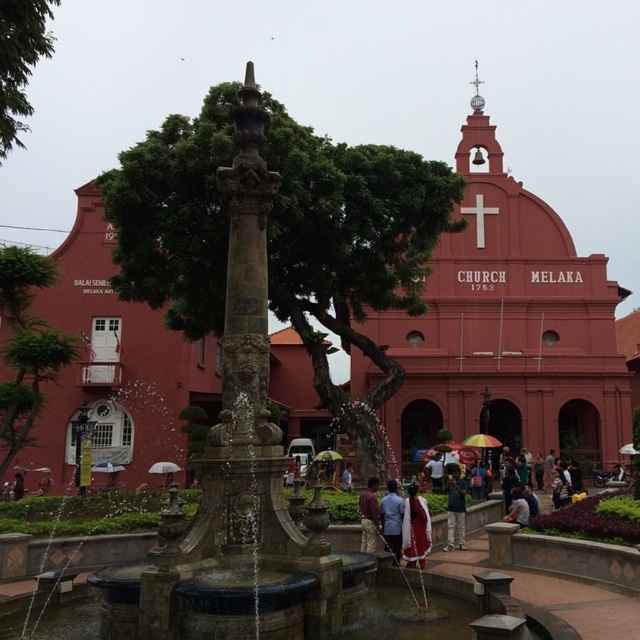
You are attending a cultural event and need to locate two specific items in the scene. The matte red dress at center and the light blue fabric shirt at lower right are both present. Which item is positioned more to the east in the image?

The matte red dress at center is to the left of light blue fabric shirt at lower right. Since the scene is oriented with the church facing north, left would correspond to the east direction. Therefore, the matte red dress at center is positioned more to the east.